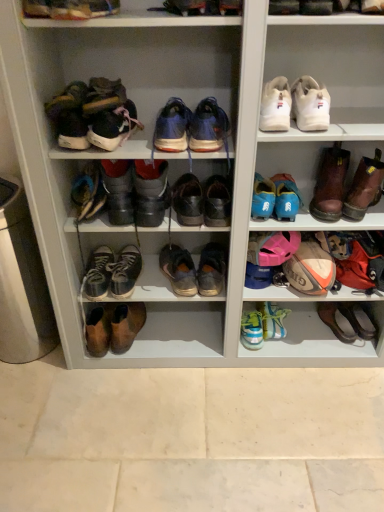
The height and width of the screenshot is (512, 384). I want to click on vacant area located to the right-hand side of light blue fabric sneaker at lower center, arranged as the first shoe when viewed from the right, so click(316, 338).